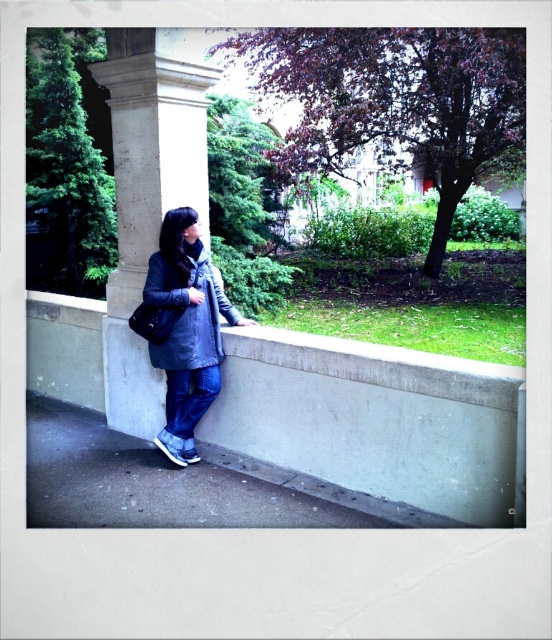
Is matte gray concrete wall at center closer to camera compared to concrete ledge at center?

No, matte gray concrete wall at center is behind concrete ledge at center.

Between matte gray concrete wall at center and concrete ledge at center, which one has more height?

With more height is matte gray concrete wall at center.

Describe the element at coordinates (246, 376) in the screenshot. I see `matte gray concrete wall at center` at that location.

Where is `matte gray concrete wall at center`? matte gray concrete wall at center is located at coordinates (246, 376).

You are a GUI agent. You are given a task and a screenshot of the screen. Output one action in this format:
    pyautogui.click(x=<x>, y=<y>)
    Task: Click on the concrete ledge at center
    This screenshot has width=552, height=640.
    Given the screenshot: What is the action you would take?
    pyautogui.click(x=376, y=422)

Is concrete ledge at center above denim jacket at center?

No, concrete ledge at center is not above denim jacket at center.

What are the coordinates of `concrete ledge at center` in the screenshot? It's located at (376, 422).

Is point (118, 339) positioned after point (201, 252)?

That is True.

Is smooth concrete pillar at center to the left of denim jacket at center from the viewer's perspective?

Indeed, smooth concrete pillar at center is positioned on the left side of denim jacket at center.

The width and height of the screenshot is (552, 640). What do you see at coordinates (148, 189) in the screenshot? I see `smooth concrete pillar at center` at bounding box center [148, 189].

You are a GUI agent. You are given a task and a screenshot of the screen. Output one action in this format:
    pyautogui.click(x=<x>, y=<y>)
    Task: Click on the smooth concrete pillar at center
    
    Given the screenshot: What is the action you would take?
    pyautogui.click(x=148, y=189)